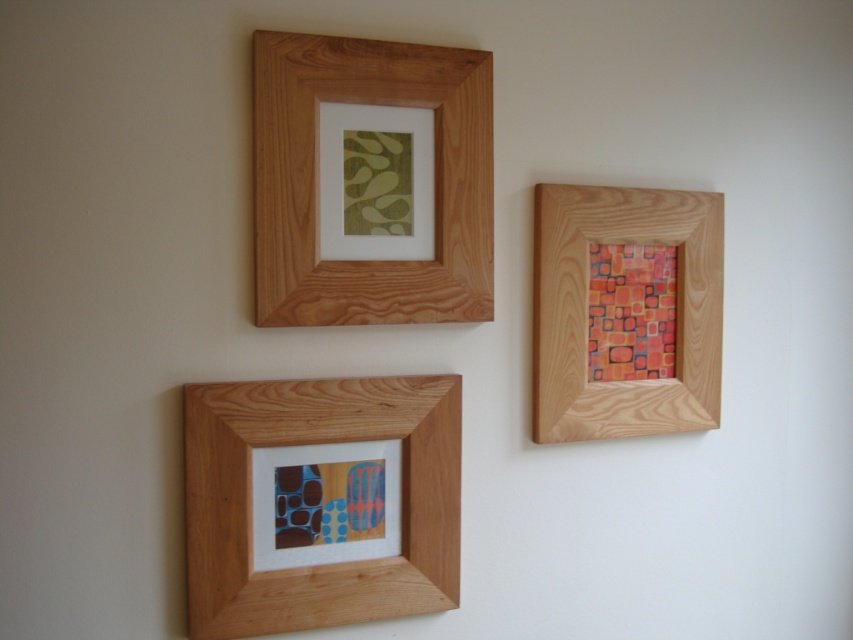
Looking at this image, who is positioned more to the right, wooden frame at lower left or wooden frame at upper right?

wooden frame at upper right

Between point (193, 540) and point (643, 205), which one is positioned in front?

Point (193, 540) is in front.

Is point (413, 424) positioned behind point (579, 390)?

No.

Find the location of a particular element. wooden frame at lower left is located at coordinates (310, 444).

Which of these two, multicolored painted squares at upper right or wooden frame at upper center, stands shorter?

wooden frame at upper center is shorter.

Between multicolored painted squares at upper right and wooden frame at upper center, which one appears on the left side from the viewer's perspective?

From the viewer's perspective, wooden frame at upper center appears more on the left side.

Between point (651, 250) and point (350, 138), which one is positioned in front?

Point (350, 138) is more forward.

At what (x,y) coordinates should I click in order to perform the action: click on multicolored painted squares at upper right. Please return your answer as a coordinate pair (x, y). This screenshot has height=640, width=853. Looking at the image, I should click on (631, 310).

Can you confirm if wooden frame at upper left is shorter than multicolored painted squares at upper right?

In fact, wooden frame at upper left may be taller than multicolored painted squares at upper right.

Which is in front, point (276, 35) or point (674, 298)?

Point (276, 35)

At what (x,y) coordinates should I click in order to perform the action: click on wooden frame at upper left. Please return your answer as a coordinate pair (x, y). The width and height of the screenshot is (853, 640). Looking at the image, I should click on (317, 180).